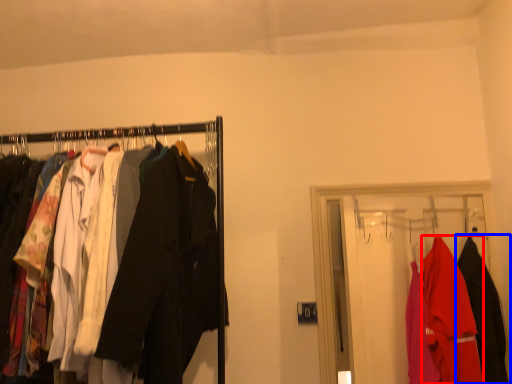
Question: Among these objects, which one is farthest to the camera, fancy dress (highlighted by a red box) or fancy dress (highlighted by a blue box)?

Choices:
 (A) fancy dress
 (B) fancy dress

Answer: (B)